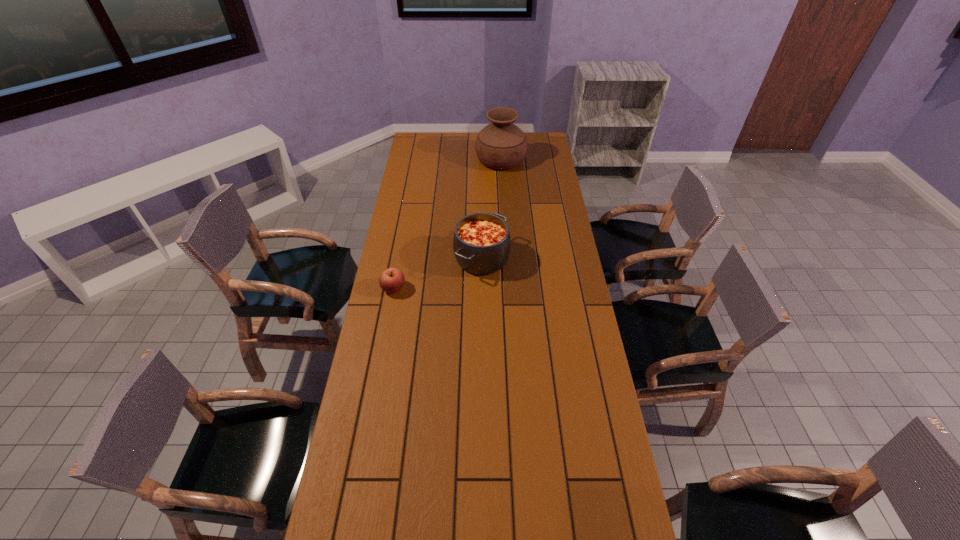
Locate which object ranks second in proximity to the urn. Please provide its 2D coordinates. Your answer should be formatted as a tuple, i.e. [(x, y)], where the tuple contains the x and y coordinates of a point satisfying the conditions above.

[(392, 280)]

The width and height of the screenshot is (960, 540). What are the coordinates of `object that is the second closest to the second shortest object` in the screenshot? It's located at (501, 145).

Where is `vacant space that satisfies the following two spatial constraints: 1. on the back side of the shortest object; 2. on the right side of the tallest object`? This screenshot has width=960, height=540. vacant space that satisfies the following two spatial constraints: 1. on the back side of the shortest object; 2. on the right side of the tallest object is located at coordinates (418, 159).